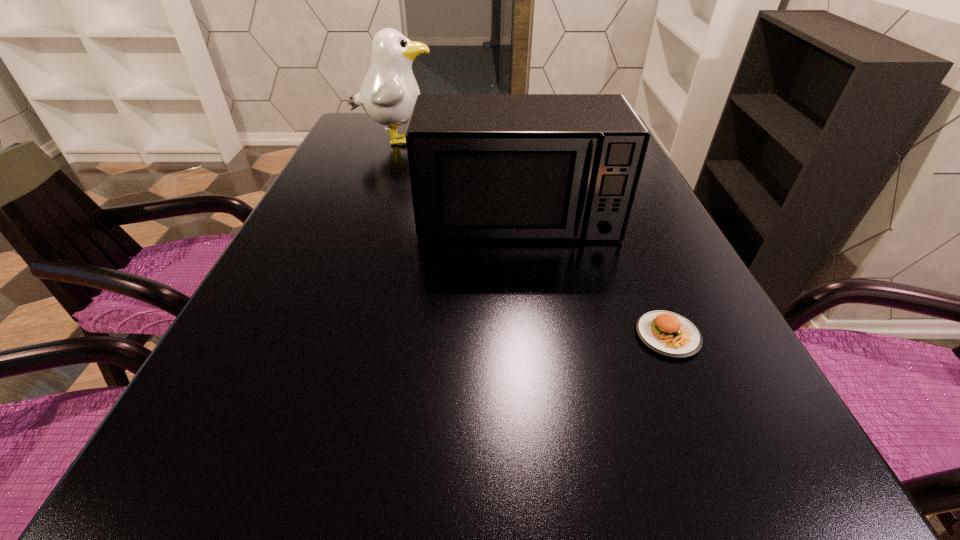
Identify the location of object present at the left edge. (388, 92).

Where is `microwave_oven present at the right edge`? The height and width of the screenshot is (540, 960). microwave_oven present at the right edge is located at coordinates (482, 166).

Where is `food positioned at the right edge`? This screenshot has width=960, height=540. food positioned at the right edge is located at coordinates (667, 333).

Where is `object present at the far left corner`? object present at the far left corner is located at coordinates (388, 92).

Where is `free region at the far edge`? The height and width of the screenshot is (540, 960). free region at the far edge is located at coordinates (402, 130).

You are a GUI agent. You are given a task and a screenshot of the screen. Output one action in this format:
    pyautogui.click(x=<x>, y=<y>)
    Task: Click on the blank area at the left edge
    The image size is (960, 540).
    Given the screenshot: What is the action you would take?
    pyautogui.click(x=330, y=301)

In order to click on free location at the right edge of the desktop in this screenshot , I will do `click(737, 375)`.

Where is `vacant space at the far left corner`? The image size is (960, 540). vacant space at the far left corner is located at coordinates (362, 142).

The height and width of the screenshot is (540, 960). What are the coordinates of `free space that is in between the second nearest object and the nearest object` in the screenshot? It's located at (592, 276).

I want to click on object that ranks as the closest to the food, so click(x=482, y=166).